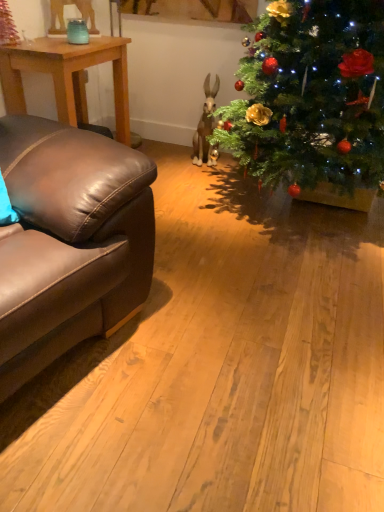
Question: In terms of height, does brown leather couch at left look taller or shorter compared to light brown wooden table at left?

Choices:
 (A) tall
 (B) short

Answer: (A)

Question: Looking at the image, does brown leather couch at left seem bigger or smaller compared to light brown wooden table at left?

Choices:
 (A) big
 (B) small

Answer: (A)

Question: Considering their positions, is brown leather couch at left located in front of or behind light brown wooden table at left?

Choices:
 (A) behind
 (B) front

Answer: (B)

Question: Based on their sizes in the image, would you say light brown wooden table at left is bigger or smaller than brown leather couch at left?

Choices:
 (A) big
 (B) small

Answer: (B)

Question: Is point (129, 117) closer or farther from the camera than point (54, 247)?

Choices:
 (A) closer
 (B) farther

Answer: (B)

Question: From the image's perspective, is light brown wooden table at left positioned above or below brown leather couch at left?

Choices:
 (A) below
 (B) above

Answer: (B)

Question: Based on their positions, is light brown wooden table at left located to the left or right of brown leather couch at left?

Choices:
 (A) left
 (B) right

Answer: (A)